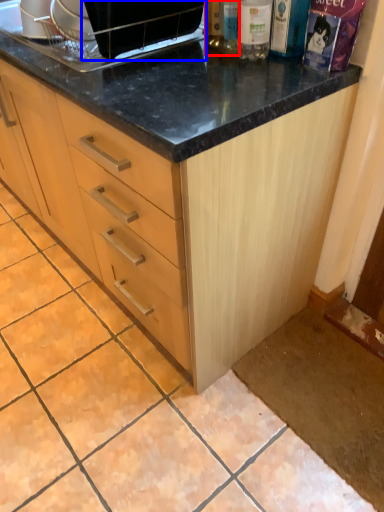
Question: Which object appears farthest to the camera in this image, bottle (highlighted by a red box) or appliance (highlighted by a blue box)?

Choices:
 (A) bottle
 (B) appliance

Answer: (A)